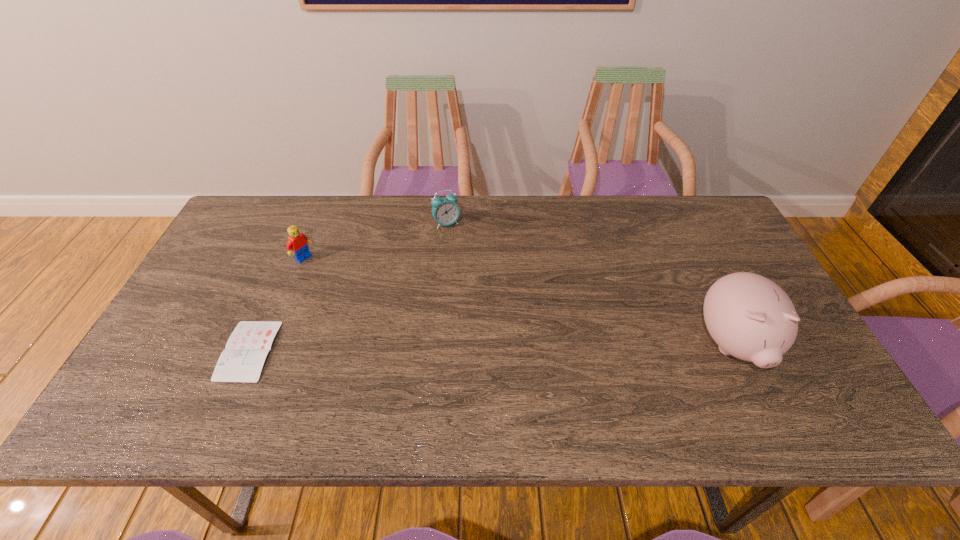
At what (x,y) coordinates should I click in order to perform the action: click on blank space located 0.300m on the face of the Lego. Please return your answer as a coordinate pair (x, y). Looking at the image, I should click on (381, 310).

This screenshot has width=960, height=540. Identify the location of vacant space located 0.170m on the face of the Lego. (348, 288).

Identify the location of free region located on the face of the Lego. The image size is (960, 540). (395, 320).

The height and width of the screenshot is (540, 960). Identify the location of object located in the far edge section of the desktop. [445, 211].

Where is `diary present at the near edge`? The width and height of the screenshot is (960, 540). diary present at the near edge is located at coordinates (242, 360).

At what (x,y) coordinates should I click in order to perform the action: click on piggy bank present at the near edge. Please return your answer as a coordinate pair (x, y). Image resolution: width=960 pixels, height=540 pixels. Looking at the image, I should click on (750, 317).

The height and width of the screenshot is (540, 960). Find the location of `object situated at the right edge`. object situated at the right edge is located at coordinates (750, 317).

Locate an element on the screen. Image resolution: width=960 pixels, height=540 pixels. object situated at the near right corner is located at coordinates (750, 317).

Where is `vacant region at the far edge of the desktop`? Image resolution: width=960 pixels, height=540 pixels. vacant region at the far edge of the desktop is located at coordinates (298, 199).

Identify the location of free point at the near edge. (577, 388).